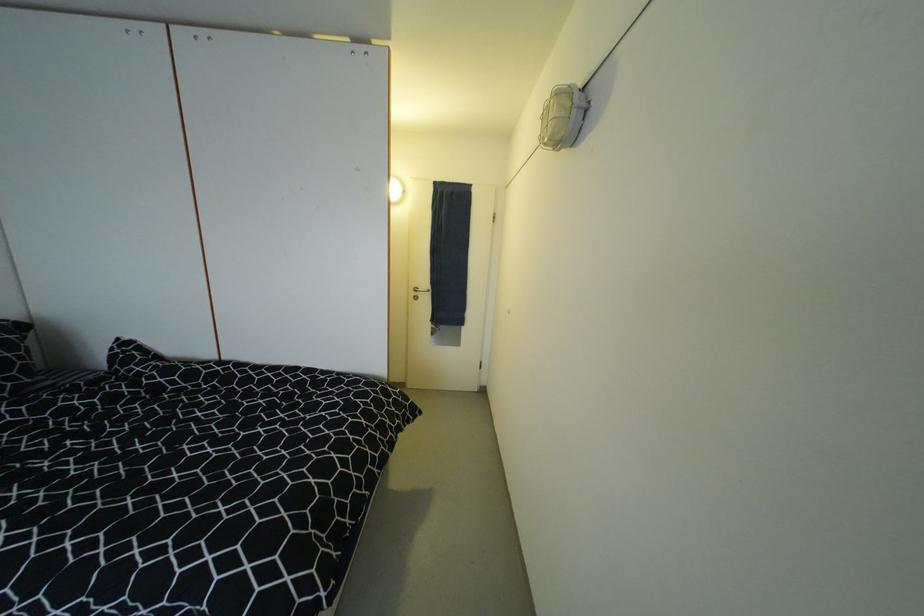
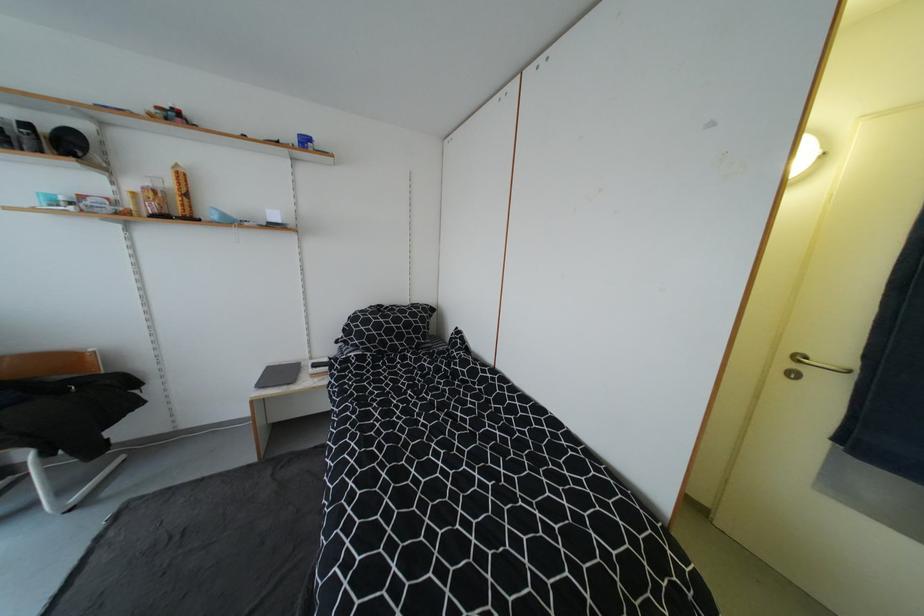
The point at [421,300] is marked in the first image. Where is the corresponding point in the second image?

(798, 376)